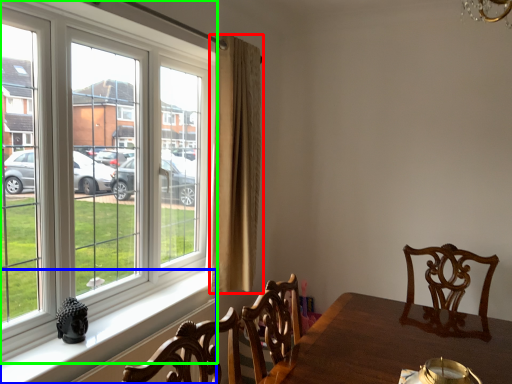
Question: Considering the real-world distances, which object is closest to curtain (highlighted by a red box)? window sill (highlighted by a blue box) or window (highlighted by a green box).

Choices:
 (A) window sill
 (B) window

Answer: (B)